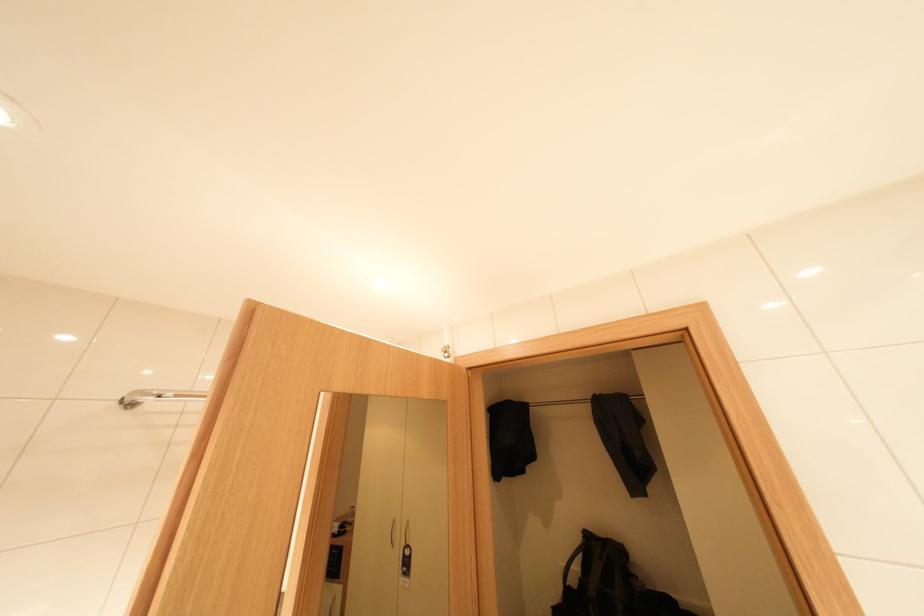
Identify the location of metal clothing rod. This screenshot has height=616, width=924. (565, 400).